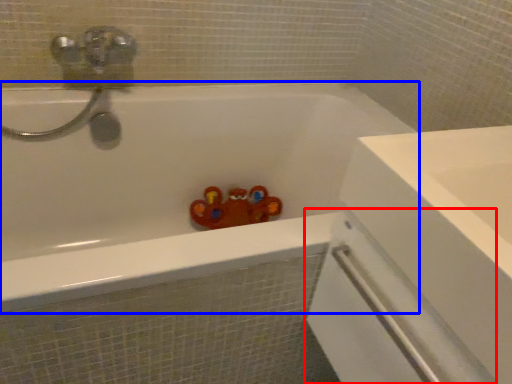
Question: Which point is closer to the camera, screen door (highlighted by a red box) or bathtub (highlighted by a blue box)?

Choices:
 (A) screen door
 (B) bathtub

Answer: (A)